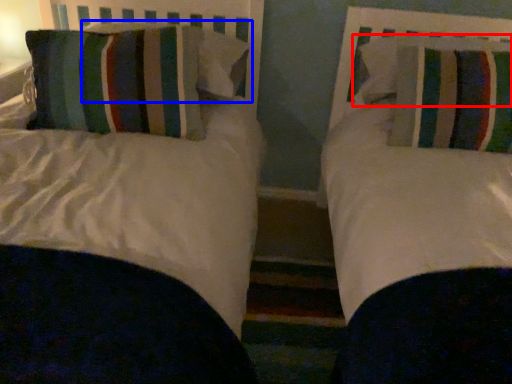
Question: Among these objects, which one is farthest to the camera, pillow (highlighted by a red box) or pillow (highlighted by a blue box)?

Choices:
 (A) pillow
 (B) pillow

Answer: (B)